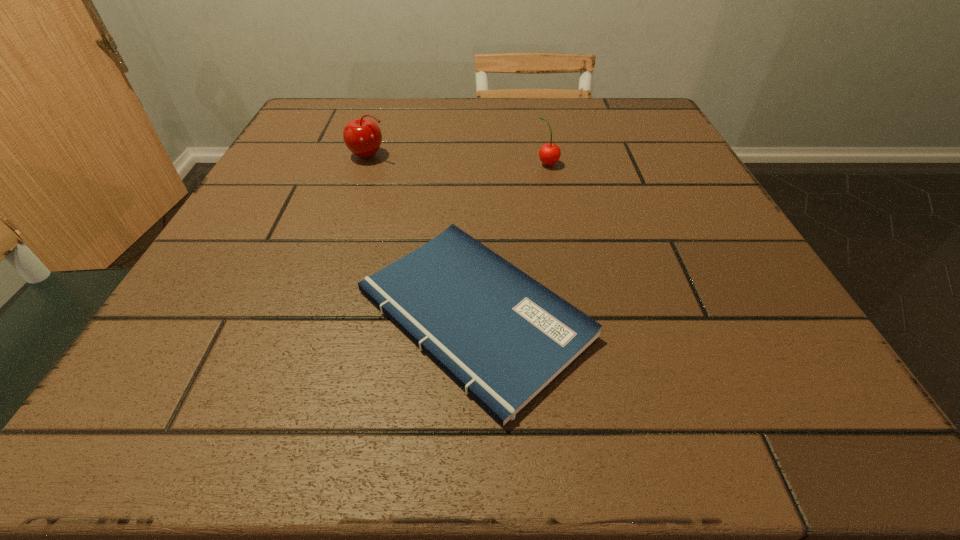
Identify the location of free region at the left edge of the desktop. This screenshot has height=540, width=960. (333, 197).

This screenshot has width=960, height=540. In the image, there is a desktop. What are the coordinates of `vacant space at the right edge` in the screenshot? It's located at (718, 222).

Where is `free spot at the near left corner of the desktop`? This screenshot has height=540, width=960. free spot at the near left corner of the desktop is located at coordinates (136, 417).

I want to click on free spot at the far right corner of the desktop, so click(660, 114).

The image size is (960, 540). I want to click on free location at the near right corner, so click(822, 411).

Find the location of a particular element. This screenshot has height=540, width=960. vacant space that is in between the left cherry and the right cherry is located at coordinates (458, 159).

Where is `free space that is in between the right cherry and the nearest object`? The width and height of the screenshot is (960, 540). free space that is in between the right cherry and the nearest object is located at coordinates (511, 239).

Where is `empty location between the right cherry and the shortest object`? This screenshot has width=960, height=540. empty location between the right cherry and the shortest object is located at coordinates (511, 239).

Where is `free space that is in between the right cherry and the shortest object`? The width and height of the screenshot is (960, 540). free space that is in between the right cherry and the shortest object is located at coordinates (511, 239).

Find the location of a particular element. empty space between the right cherry and the shortest object is located at coordinates (511, 239).